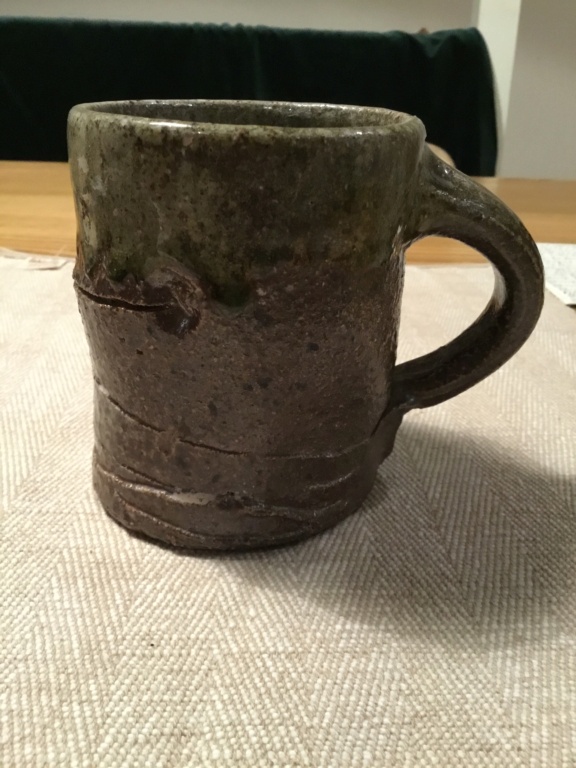
Find the location of `handle of mug`. handle of mug is located at coordinates (522, 223).